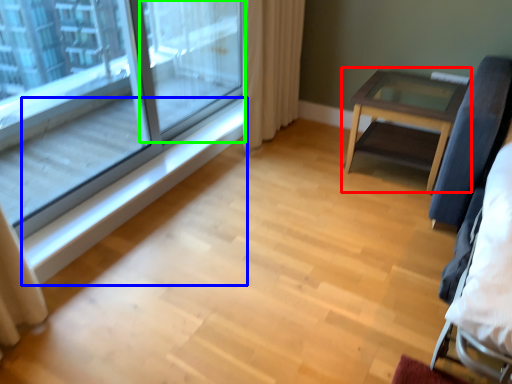
Question: Which is nearer to the table (highlighted by a red box)? window sill (highlighted by a blue box) or screen door (highlighted by a green box).

Choices:
 (A) window sill
 (B) screen door

Answer: (A)